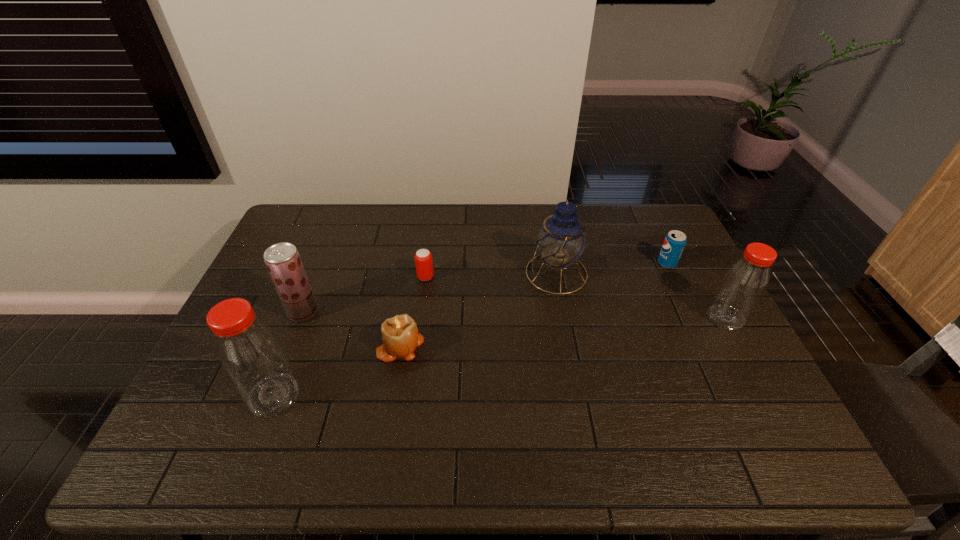
In order to click on vacant space that satisfies the following two spatial constraints: 1. on the front-facing side of the third object from right to left; 2. on the front side of the left bottle in this screenshot , I will do `click(579, 395)`.